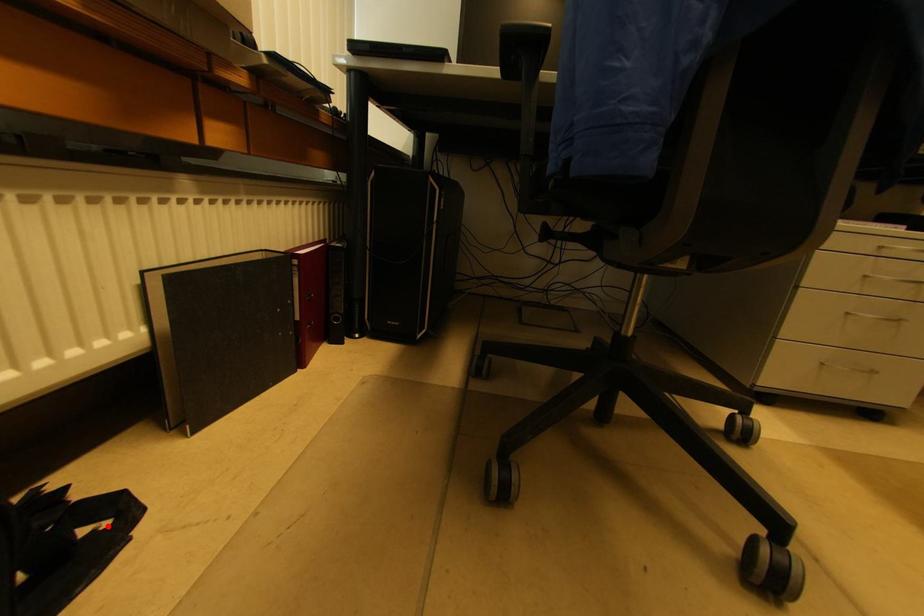
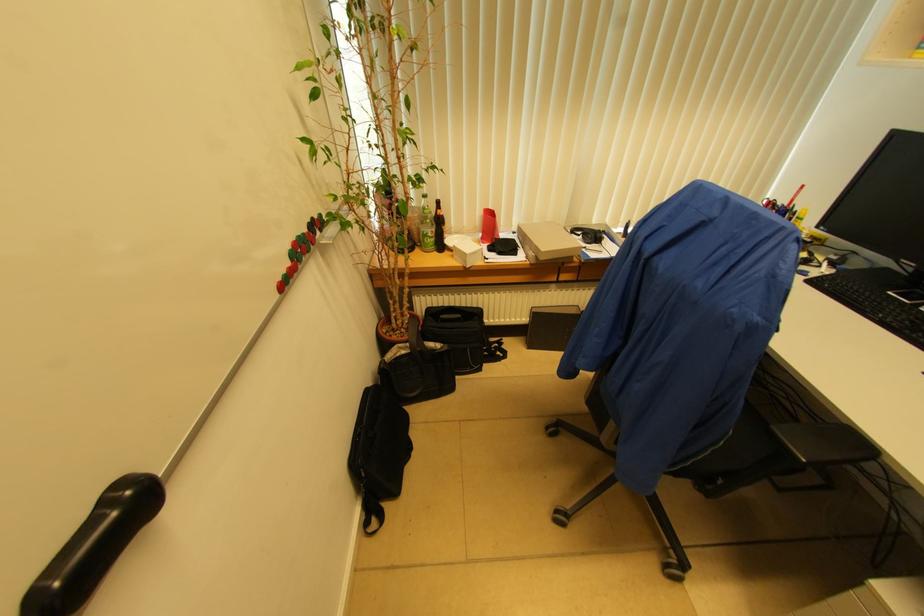
The point at the highlighted location is marked in the first image. Where is the corresponding point in the second image?

(503, 358)